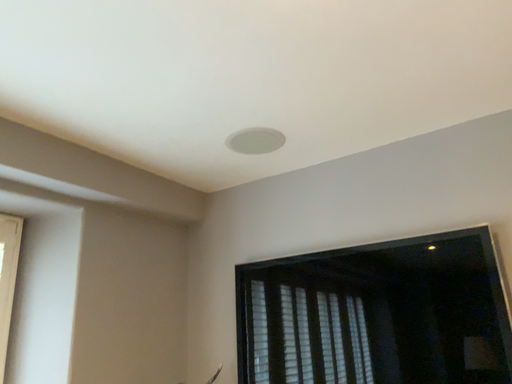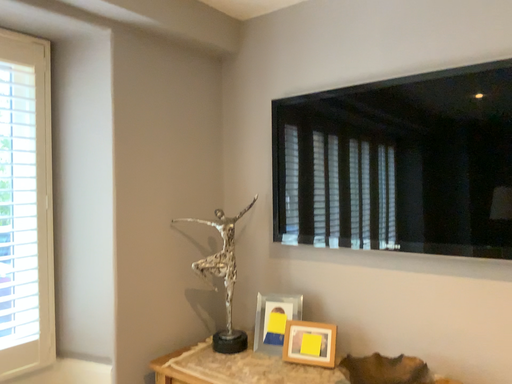
Question: How did the camera likely rotate when shooting the video?

Choices:
 (A) rotated upward
 (B) rotated downward

Answer: (B)